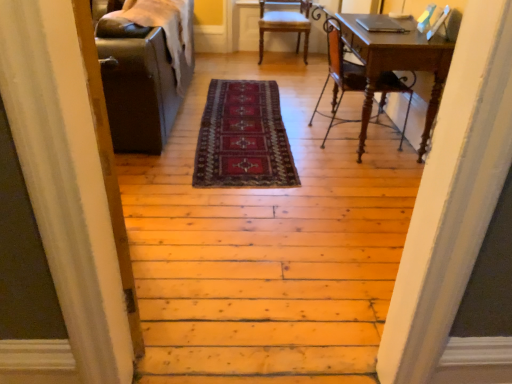
Find the location of a particular element. This screenshot has height=384, width=512. free location in front of wooden desk at right is located at coordinates (355, 178).